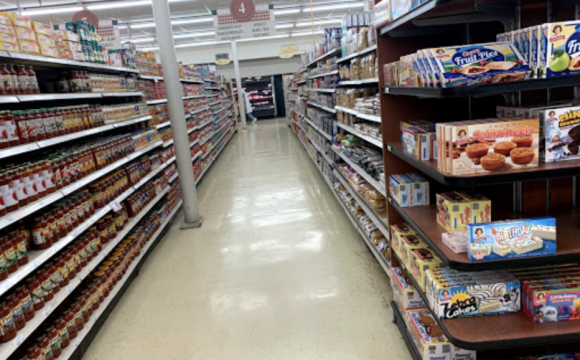
You are a GUI agent. You are given a task and a screenshot of the screen. Output one action in this format:
    pyautogui.click(x=<x>, y=<y>)
    Task: Click on the shelves
    
    Given the screenshot: What is the action you would take?
    pyautogui.click(x=56, y=59), pyautogui.click(x=66, y=92), pyautogui.click(x=81, y=134), pyautogui.click(x=90, y=179), pyautogui.click(x=97, y=215), pyautogui.click(x=112, y=248), pyautogui.click(x=130, y=273)